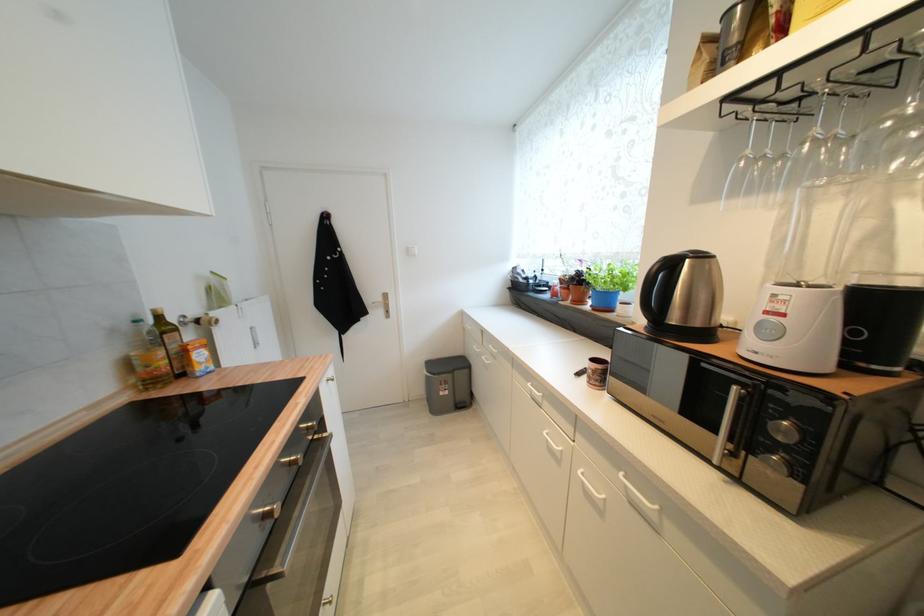
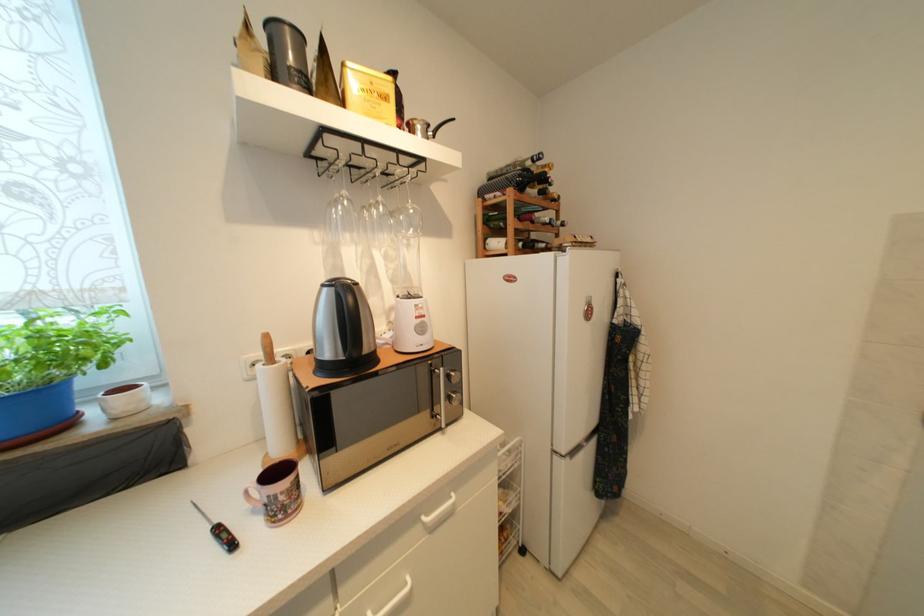
In the second image, find the point that corresponds to [743,46] in the first image.

(305, 74)